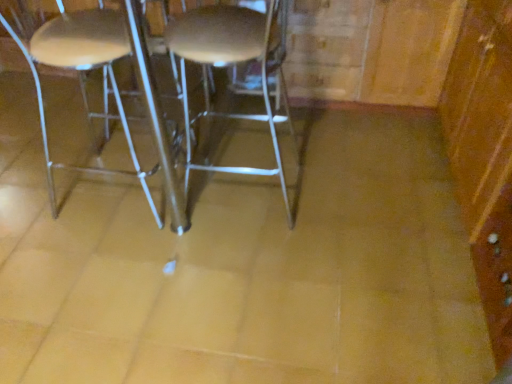
Find the location of a particular element. free area behind metallic silver stool at center is located at coordinates (245, 139).